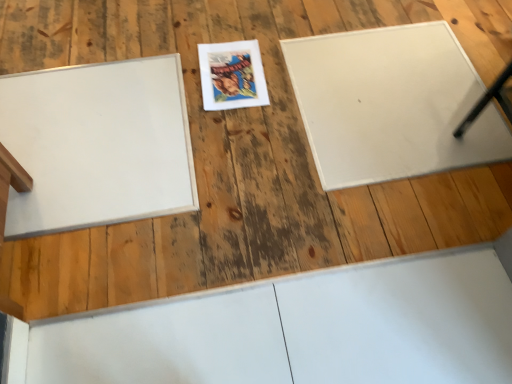
The width and height of the screenshot is (512, 384). What are the coordinates of `free spot in front of white matte board at upper right, which appears as the 1th bulletin board when viewed from the right` in the screenshot? It's located at (377, 219).